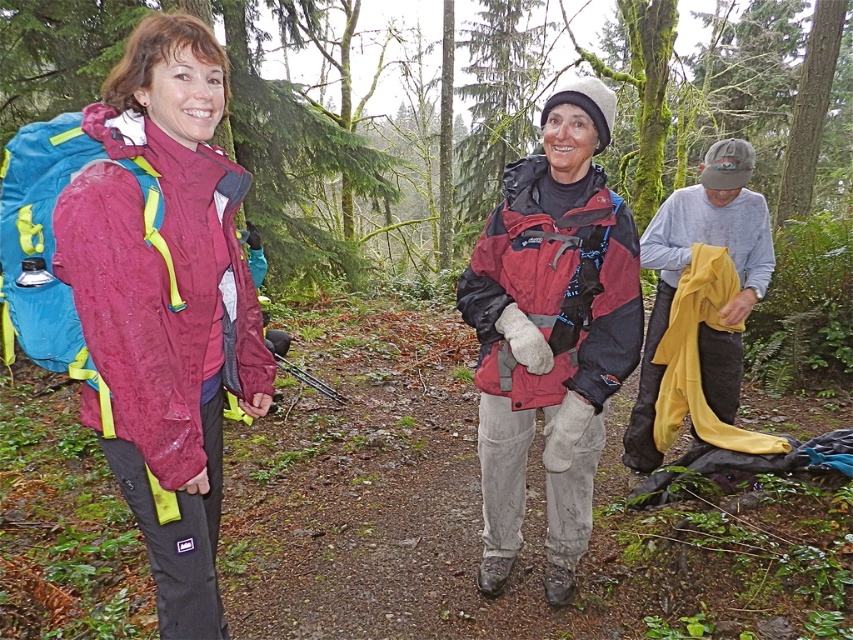
Based on the photo, does wet matte jacket at left lie behind yellow fabric at right?

No, it is in front of yellow fabric at right.

Which is more to the left, wet matte jacket at left or yellow fabric at right?

From the viewer's perspective, wet matte jacket at left appears more on the left side.

Is point (177, 26) less distant than point (685, 243)?

Yes, point (177, 26) is closer to viewer.

Locate an element on the screen. wet matte jacket at left is located at coordinates (166, 301).

Between reddish-brown waterproof jacket at center and yellow fabric at right, which one appears on the left side from the viewer's perspective?

reddish-brown waterproof jacket at center is more to the left.

Which of these two, reddish-brown waterproof jacket at center or yellow fabric at right, stands shorter?

With less height is yellow fabric at right.

Which is behind, point (492, 486) or point (637, 401)?

Point (637, 401)

I want to click on reddish-brown waterproof jacket at center, so click(550, 332).

Consider the image. Is wet matte jacket at left bigger than reddish-brown waterproof jacket at center?

No, wet matte jacket at left is not bigger than reddish-brown waterproof jacket at center.

Who is more distant from viewer, (96, 308) or (496, 385)?

Positioned behind is point (496, 385).

Between point (140, 483) and point (527, 304), which one is positioned behind?

Positioned behind is point (527, 304).

You are a GUI agent. You are given a task and a screenshot of the screen. Output one action in this format:
    pyautogui.click(x=<x>, y=<y>)
    Task: Click on the wet matte jacket at left
    The image size is (853, 640).
    Given the screenshot: What is the action you would take?
    (x=166, y=301)